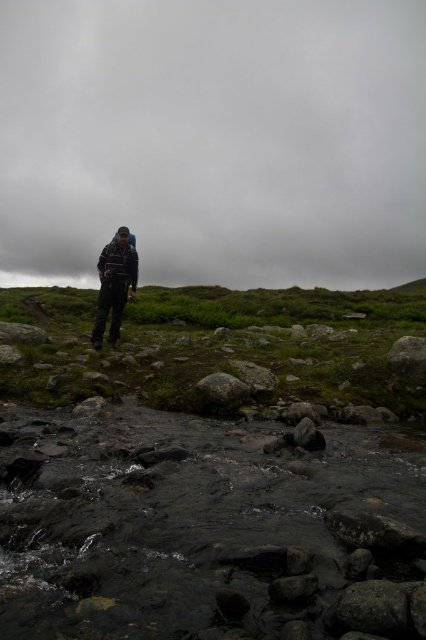
You are a hiker who needs to place a 4 meter long tent between the dark gray textured jacket at center and the green mossy rock at center. Can you fit the tent between them without overlapping either object?

The dark gray textured jacket at center and green mossy rock at center are 3.82 meters apart. Since the tent is 4 meters long, it cannot be placed between them without overlapping one of the objects.

You are a hiker trying to cross the rocky stream. You see dark green grass at left and a green mossy rock at center. Which surface would provide a more stable footing for crossing the stream?

The green mossy rock at center provides a more stable footing because it is smaller than the dark green grass at left, making it less likely to shift or move underfoot.